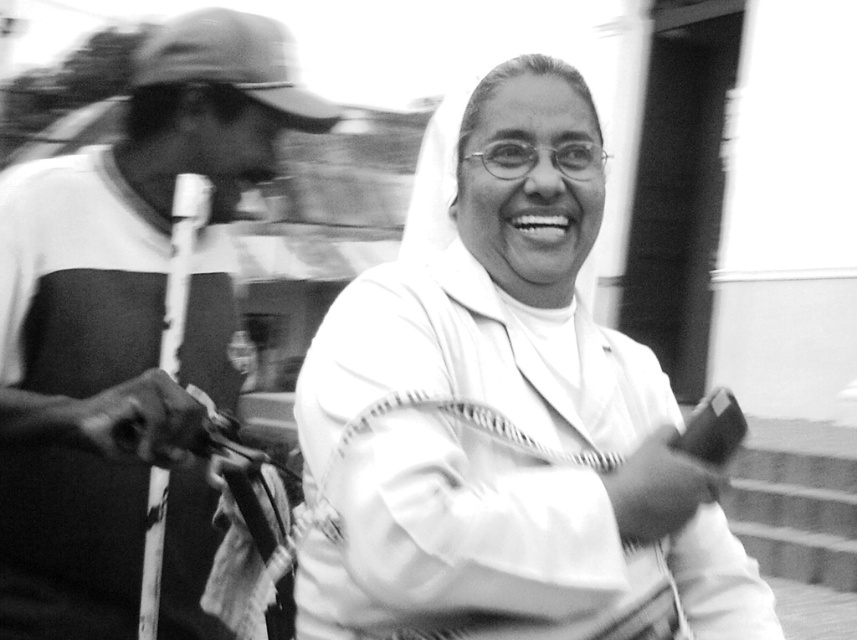
Is white matte nun's habit at center to the left of smooth fabric shirt at left from the viewer's perspective?

Incorrect, white matte nun's habit at center is not on the left side of smooth fabric shirt at left.

Can you confirm if white matte nun's habit at center is taller than smooth fabric shirt at left?

Incorrect, white matte nun's habit at center's height is not larger of smooth fabric shirt at left's.

Describe the element at coordinates (507, 419) in the screenshot. The image size is (857, 640). I see `white matte nun's habit at center` at that location.

Where is `white matte nun's habit at center`? This screenshot has height=640, width=857. white matte nun's habit at center is located at coordinates (507, 419).